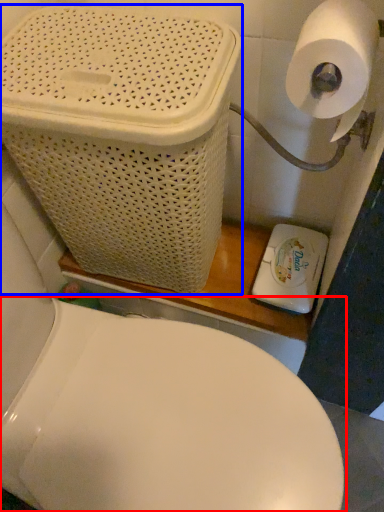
Question: Which point is further to the camera, toilet (highlighted by a red box) or basket container (highlighted by a blue box)?

Choices:
 (A) toilet
 (B) basket container

Answer: (B)